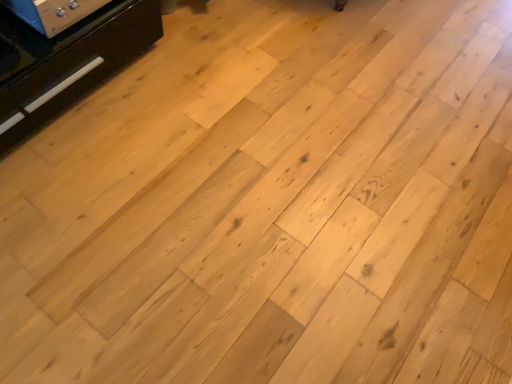
Where is `black glossy drawer at left`? Image resolution: width=512 pixels, height=384 pixels. black glossy drawer at left is located at coordinates (67, 61).

What do you see at coordinates (67, 61) in the screenshot? The image size is (512, 384). I see `black glossy drawer at left` at bounding box center [67, 61].

Locate an element on the screen. This screenshot has height=384, width=512. black glossy drawer at left is located at coordinates pos(67,61).